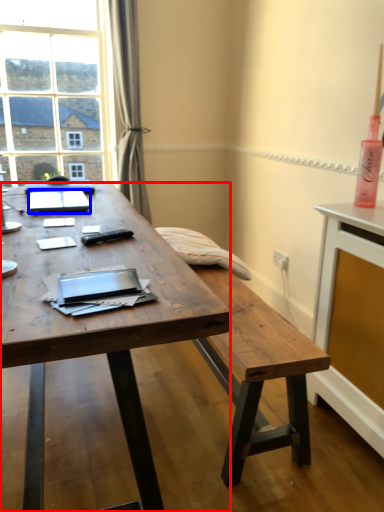
Question: Which point is further to the camera, desk (highlighted by a red box) or notebook (highlighted by a blue box)?

Choices:
 (A) desk
 (B) notebook

Answer: (B)